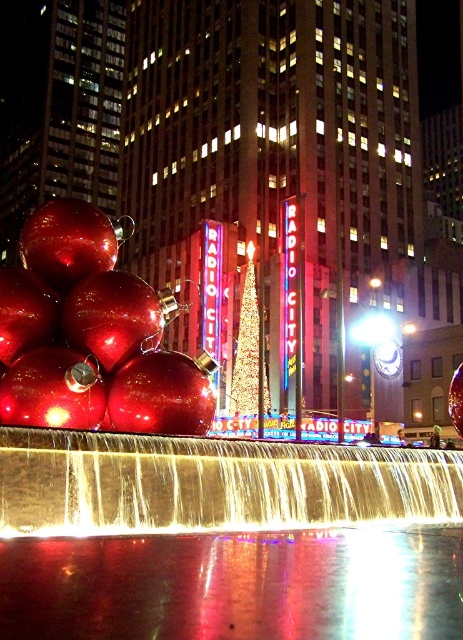
Is reflective glass waterfall at center to the left of gold glittering christmas tree at center from the viewer's perspective?

Yes, reflective glass waterfall at center is to the left of gold glittering christmas tree at center.

Does reflective glass waterfall at center have a lesser height compared to gold glittering christmas tree at center?

Yes, reflective glass waterfall at center is shorter than gold glittering christmas tree at center.

Locate an element on the screen. This screenshot has width=463, height=640. reflective glass waterfall at center is located at coordinates (225, 540).